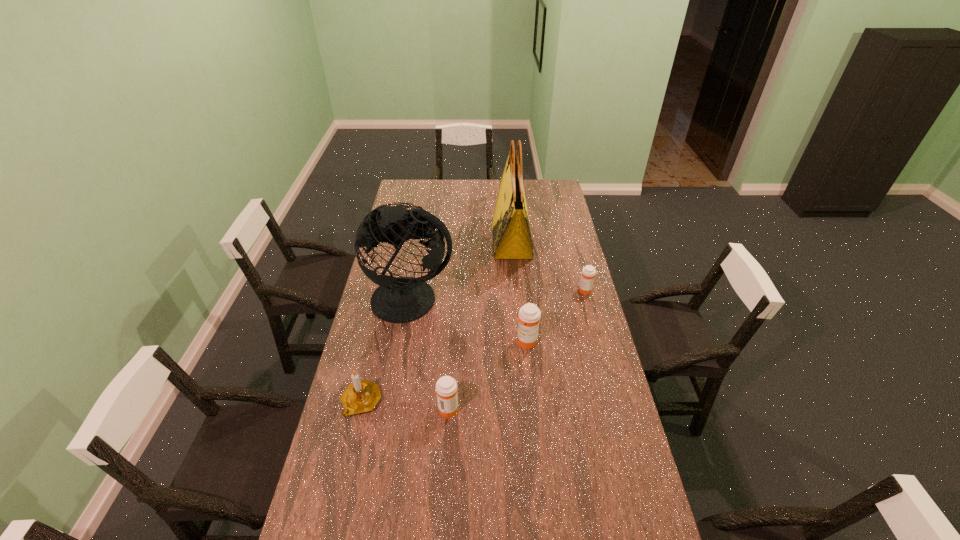
Where is `the nearest medicine`? This screenshot has height=540, width=960. the nearest medicine is located at coordinates (446, 387).

Find the location of `the second tallest medicine`. the second tallest medicine is located at coordinates (446, 387).

This screenshot has height=540, width=960. What are the coordinates of `the third nearest object` in the screenshot? It's located at (529, 317).

Locate an element on the screen. Image resolution: width=960 pixels, height=540 pixels. the second nearest medicine is located at coordinates pos(529,317).

Where is `the rightmost object`? The image size is (960, 540). the rightmost object is located at coordinates (588, 272).

Where is `the rightmost medicine`? the rightmost medicine is located at coordinates (588, 272).

The height and width of the screenshot is (540, 960). What are the coordinates of `tote bag` in the screenshot? It's located at (511, 233).

Locate an element on the screen. The height and width of the screenshot is (540, 960). globe is located at coordinates (404, 299).

I want to click on candle holder, so (x=361, y=396).

You are a GUI agent. You are given a task and a screenshot of the screen. Output one action in this format:
    pyautogui.click(x=<x>, y=<y>)
    Task: Click on the vacant space located on the front of the leftmost medicine
    This screenshot has height=540, width=960.
    Given the screenshot: What is the action you would take?
    pyautogui.click(x=446, y=433)